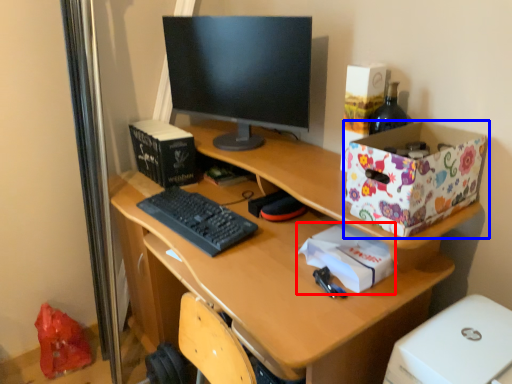
Question: Which of the following is the farthest to the observer, package (highlighted by a red box) or storage box (highlighted by a blue box)?

Choices:
 (A) package
 (B) storage box

Answer: (A)